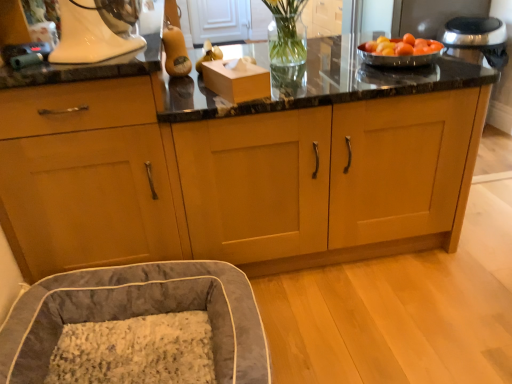
Identify the location of vacant area that is in front of silver metallic bowl at upper right. (413, 79).